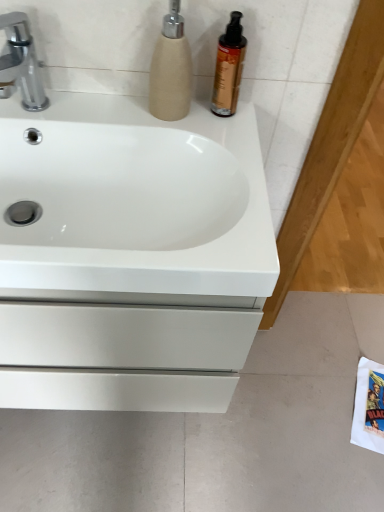
Locate an element on the screen. Image resolution: width=384 pixels, height=512 pixels. free space above white matte drawer at lower left (from a real-world perspective) is located at coordinates (265, 397).